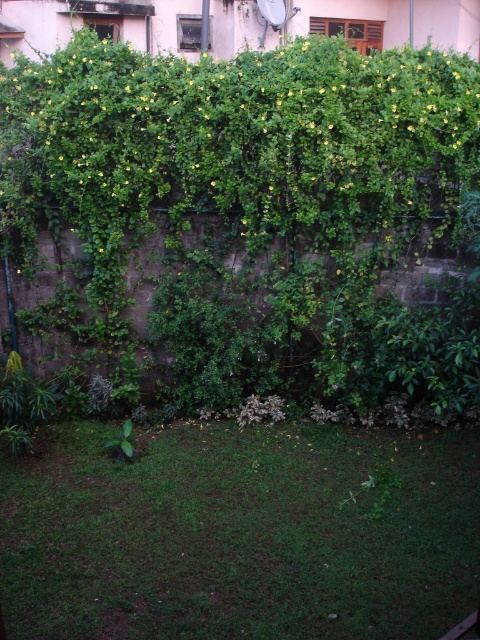
Question: Does green leafy hedge at upper center have a lesser width compared to green leafy plant at center?

Choices:
 (A) no
 (B) yes

Answer: (A)

Question: Based on their relative distances, which object is nearer to the green leafy hedge at upper center?

Choices:
 (A) green grass at lower center
 (B) green leafy plant at center

Answer: (A)

Question: Which point is farther to the camera?

Choices:
 (A) (300, 454)
 (B) (283, 192)
 (C) (113, 440)

Answer: (B)

Question: Is green leafy hedge at upper center to the right of green grass at lower center from the viewer's perspective?

Choices:
 (A) yes
 (B) no

Answer: (B)

Question: Which of the following is the farthest from the observer?

Choices:
 (A) (60, 618)
 (B) (129, 429)

Answer: (B)

Question: Does green leafy hedge at upper center appear under green leafy plant at center?

Choices:
 (A) no
 (B) yes

Answer: (A)